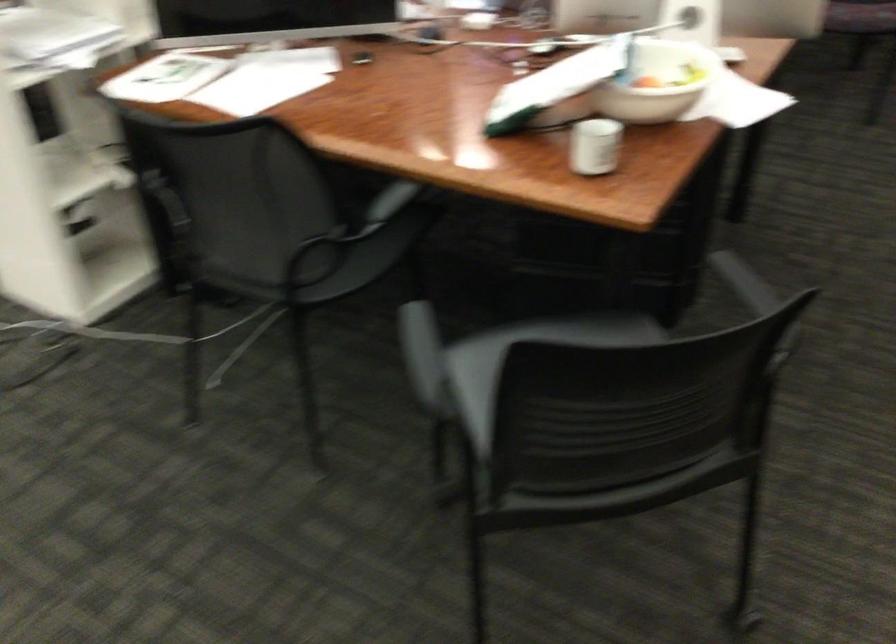
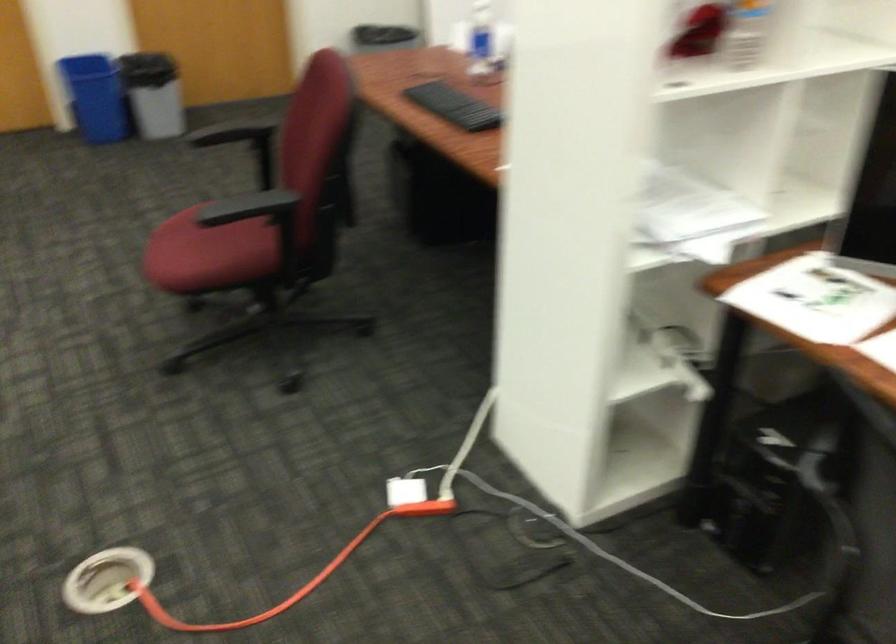
Question: The camera is either moving clockwise (left) or counter-clockwise (right) around the object. The first image is from the beginning of the video and the second image is from the end. Is the camera moving left or right when shooting the video?

Choices:
 (A) Left
 (B) Right

Answer: (B)